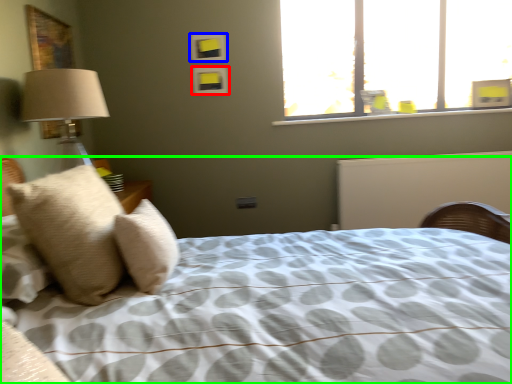
Question: Which object is the farthest from picture frame (highlighted by a red box)? Choose among these: picture frame (highlighted by a blue box) or bed (highlighted by a green box).

Choices:
 (A) picture frame
 (B) bed

Answer: (B)